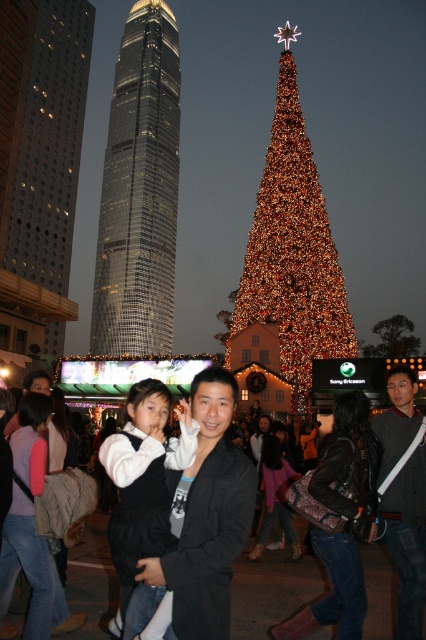
You are taking a photo of the black matte jacket at center and the illuminated gold christmas tree at center in the scene. Which object is closer to the camera?

The illuminated gold christmas tree at center is closer to the camera because the black matte jacket at center is behind it.

You are a photographer trying to capture the illuminated gold christmas tree at center and the black fabric bag at center in the same frame. Based on their sizes, which object would require you to zoom out more to include both in the shot?

The black fabric bag at center is wider than the illuminated gold christmas tree at center, so you would need to zoom out more to include both in the shot.